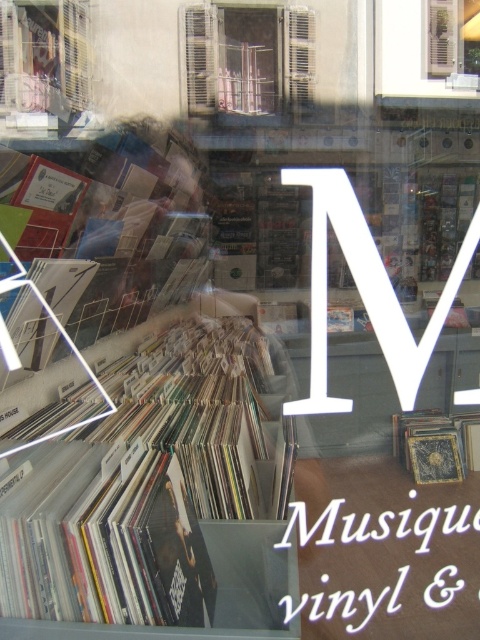
Who is more forward, (92, 460) or (406, 417)?

Point (92, 460) is in front.

Which of these two, white matte vinyl records at center or gold textured vinyl record at center, stands taller?

white matte vinyl records at center

Image resolution: width=480 pixels, height=640 pixels. What do you see at coordinates (159, 497) in the screenshot? I see `white matte vinyl records at center` at bounding box center [159, 497].

You are a GUI agent. You are given a task and a screenshot of the screen. Output one action in this format:
    pyautogui.click(x=<x>, y=<y>)
    Task: Click on the white matte vinyl records at center
    This screenshot has width=480, height=640.
    Given the screenshot: What is the action you would take?
    pyautogui.click(x=159, y=497)

Can you confirm if white matte vinyl records at center is shorter than white wooden shutters at upper center?

Incorrect, white matte vinyl records at center's height does not fall short of white wooden shutters at upper center's.

Between white matte vinyl records at center and white wooden shutters at upper center, which one has more height?

With more height is white matte vinyl records at center.

What do you see at coordinates (159, 497) in the screenshot? This screenshot has height=640, width=480. I see `white matte vinyl records at center` at bounding box center [159, 497].

The height and width of the screenshot is (640, 480). In order to click on white matte vinyl records at center in this screenshot , I will do `click(159, 497)`.

Is metallic window at upper center to the left of matte plastic window at upper left from the viewer's perspective?

In fact, metallic window at upper center is to the right of matte plastic window at upper left.

Which is in front, point (284, 77) or point (71, 28)?

Point (71, 28)

The width and height of the screenshot is (480, 640). What are the coordinates of `metallic window at upper center` in the screenshot? It's located at pyautogui.click(x=248, y=58).